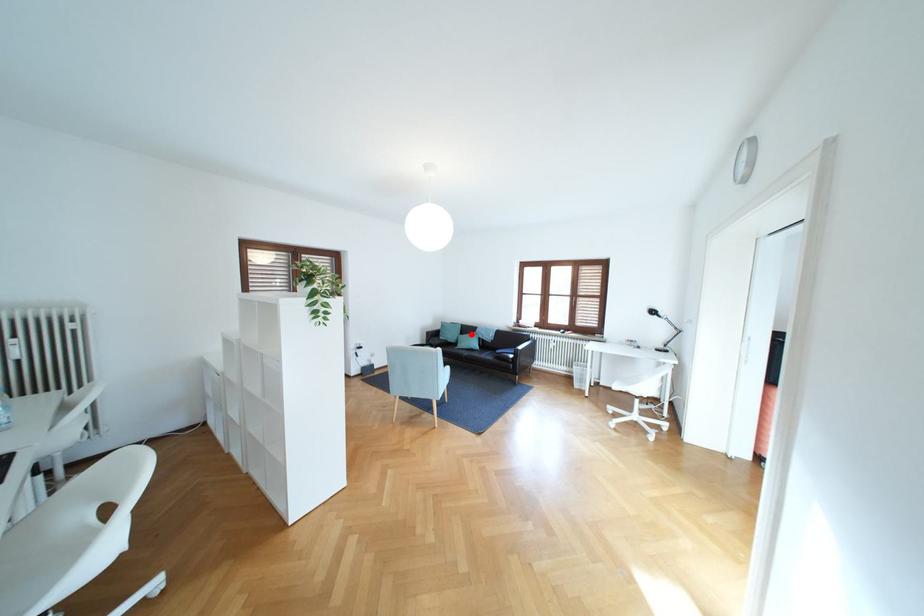
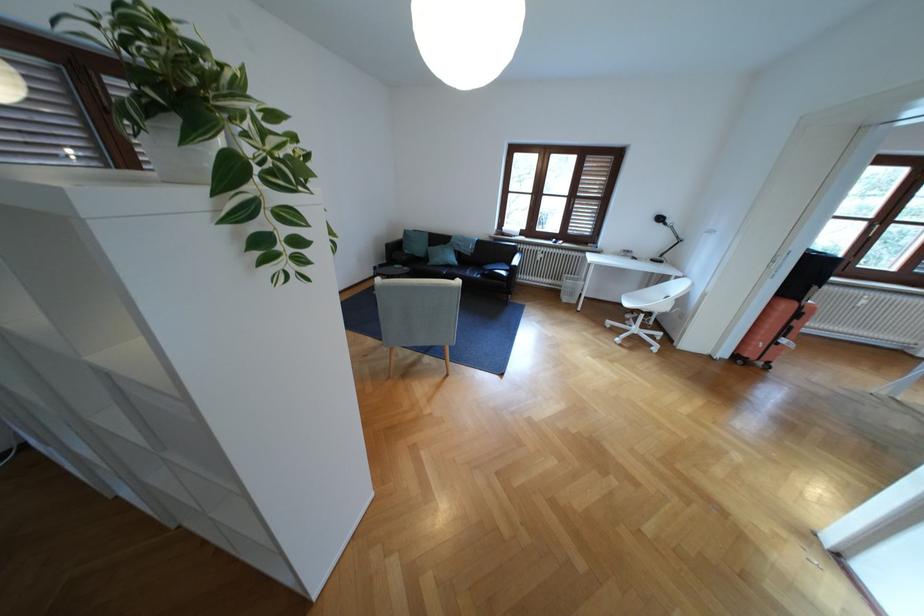
Locate, in the second image, the point that corresponds to the highlighted location in the first image.

(440, 246)